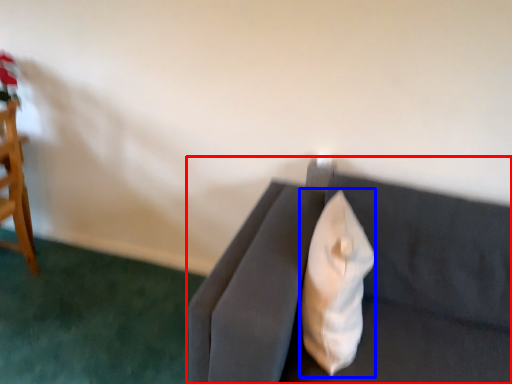
Question: Which object appears closest to the camera in this image, studio couch (highlighted by a red box) or throw pillow (highlighted by a blue box)?

Choices:
 (A) studio couch
 (B) throw pillow

Answer: (A)